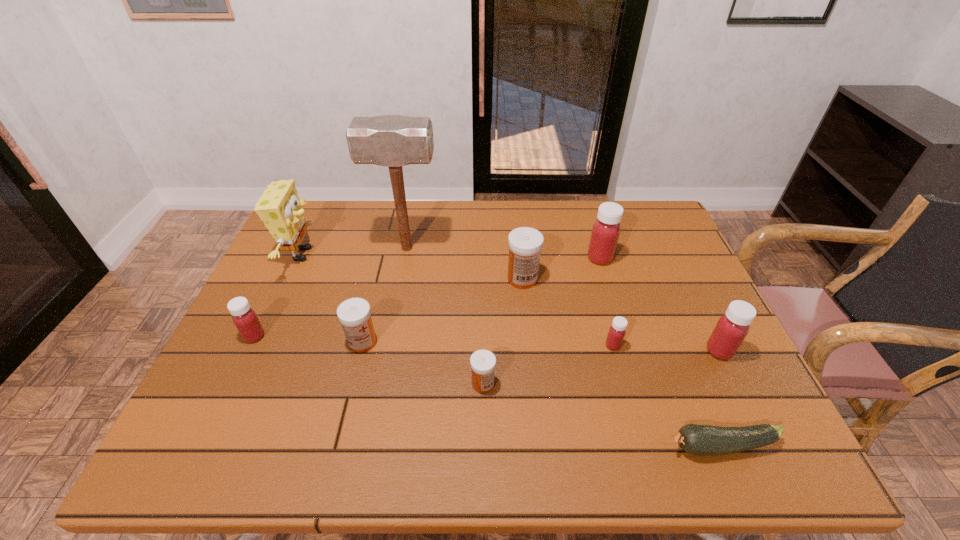
Image resolution: width=960 pixels, height=540 pixels. In order to click on mallet in this screenshot , I will do `click(392, 141)`.

I want to click on sponge, so click(280, 208).

Find the location of `the ninth shortest object`. the ninth shortest object is located at coordinates (280, 208).

Where is `the farthest medicine`? The image size is (960, 540). the farthest medicine is located at coordinates (605, 233).

This screenshot has height=540, width=960. In order to click on the farthest red medicine in this screenshot , I will do `click(605, 233)`.

Find the location of a particular element. The image size is (960, 540). the fifth object from right to left is located at coordinates (525, 244).

This screenshot has width=960, height=540. I want to click on the farthest white medicine, so click(525, 244).

This screenshot has height=540, width=960. Identify the location of the rightmost red medicine. (731, 329).

Where is `the second biggest red medicine`? the second biggest red medicine is located at coordinates (731, 329).

Locate an element on the screen. The width and height of the screenshot is (960, 540). the second biggest white medicine is located at coordinates (354, 314).